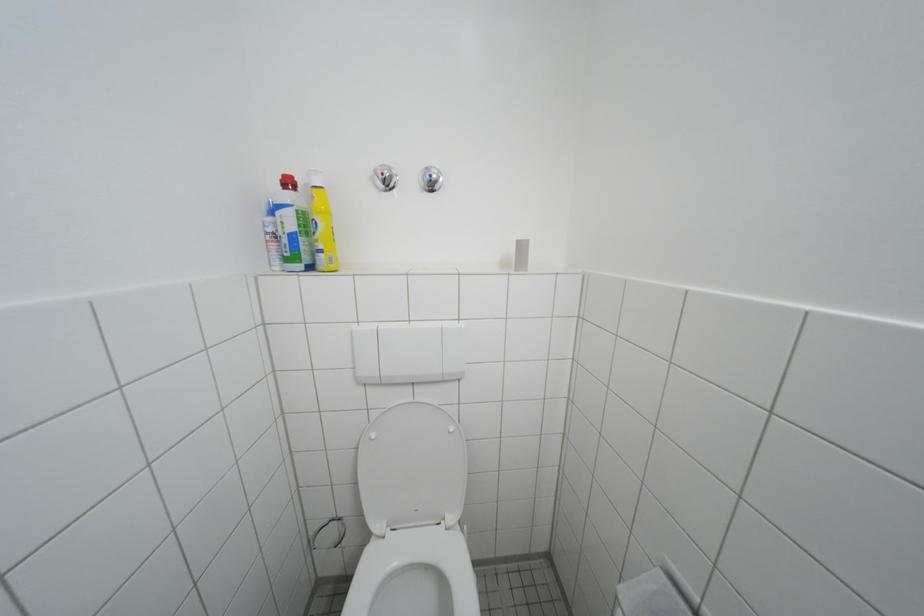
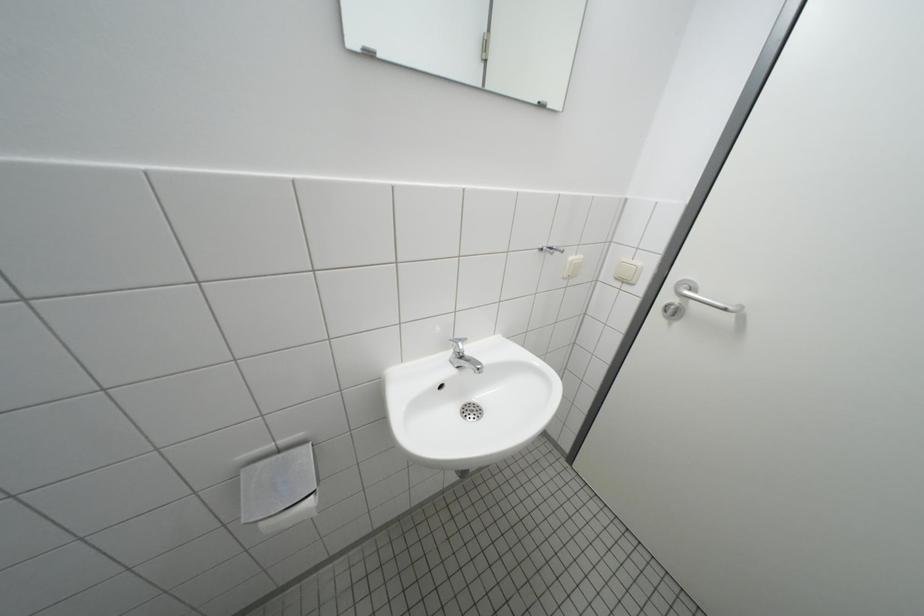
Based on the continuous images, in which direction is the camera rotating?

The camera rotated toward right-down.